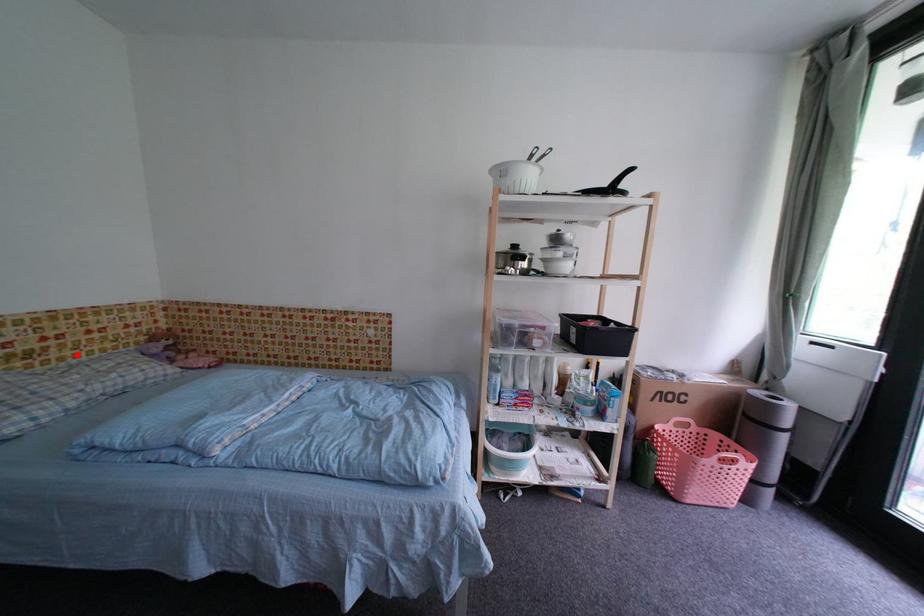
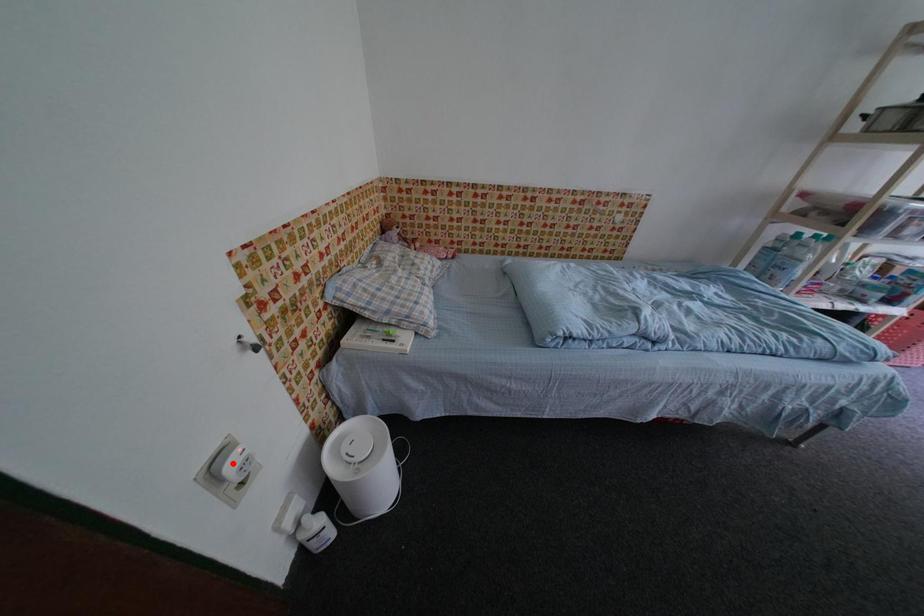
I am providing you with two images of the same scene from different viewpoints. A red point is marked on the first image and another point is marked on the second image. Is the red point in image1 aligned with the point shown in image2?

No